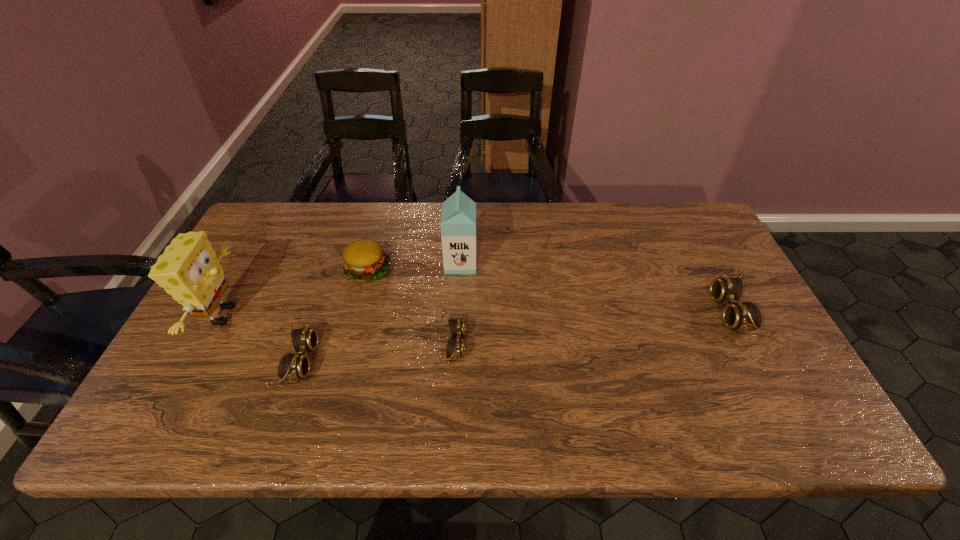
The height and width of the screenshot is (540, 960). I want to click on vacant region that satisfies the following two spatial constraints: 1. on the front side of the milk carton; 2. through the lenses of the shortest goggles, so click(x=457, y=345).

Find the location of a particular element. The width and height of the screenshot is (960, 540). free region that satisfies the following two spatial constraints: 1. on the front side of the hamburger; 2. through the lenses of the fifth object from right to left is located at coordinates (344, 361).